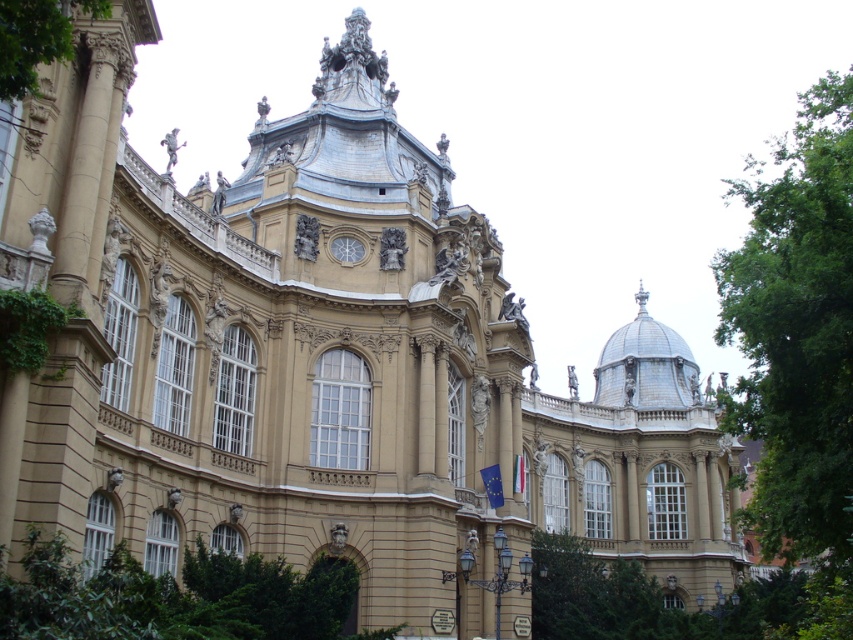
Based on the photo, you are a landscape architect planning to plant a new tree in the courtyard of the grand building. You have two options from the image provided. Which tree, the green leafy tree at lower center or the green leafy tree at lower right, has a wider canopy and would provide more shade?

The green leafy tree at lower right has a wider canopy and would provide more shade since its width is greater than the green leafy tree at lower center.